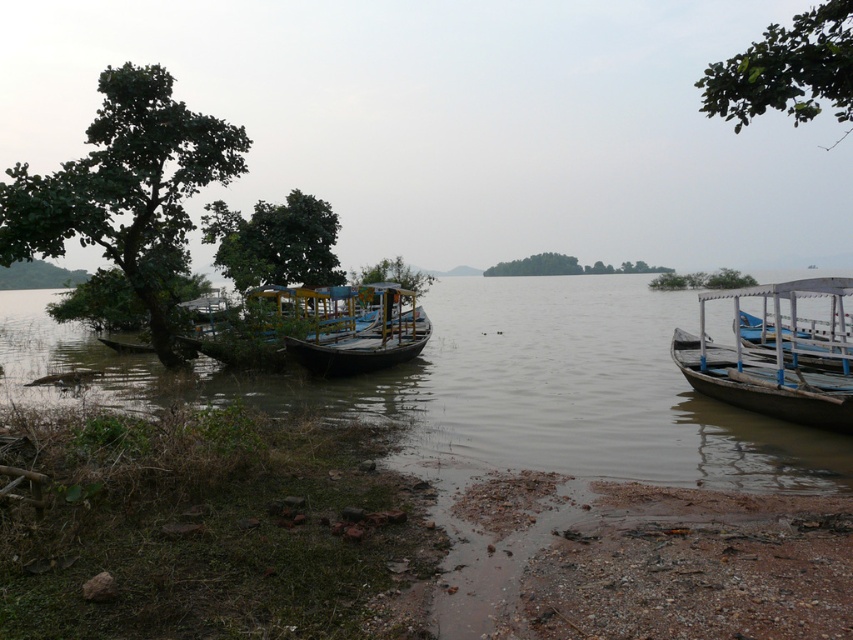
Does wooden boat at right appear on the left side of green leafy tree at center?

No, wooden boat at right is not to the left of green leafy tree at center.

Between wooden boat at right and green leafy tree at center, which one appears on the right side from the viewer's perspective?

From the viewer's perspective, wooden boat at right appears more on the right side.

Is point (830, 282) farther from camera compared to point (236, 264)?

No, it is in front of (236, 264).

You are a GUI agent. You are given a task and a screenshot of the screen. Output one action in this format:
    pyautogui.click(x=<x>, y=<y>)
    Task: Click on the wooden boat at right
    The width and height of the screenshot is (853, 640).
    Given the screenshot: What is the action you would take?
    pyautogui.click(x=776, y=355)

Looking at this image, is green leafy island at center smaller than green matte tree at center?

Yes.

Looking at this image, is green leafy island at center to the left of green matte tree at center from the viewer's perspective?

In fact, green leafy island at center is to the right of green matte tree at center.

Describe the element at coordinates (537, 266) in the screenshot. The image size is (853, 640). I see `green leafy island at center` at that location.

You are a GUI agent. You are given a task and a screenshot of the screen. Output one action in this format:
    pyautogui.click(x=<x>, y=<y>)
    Task: Click on the green leafy island at center
    This screenshot has height=640, width=853.
    Given the screenshot: What is the action you would take?
    pos(537,266)

Who is more forward, (699, 300) or (384, 259)?

Point (699, 300)

Locate an element on the screen. The image size is (853, 640). wooden boat at right is located at coordinates (776, 355).